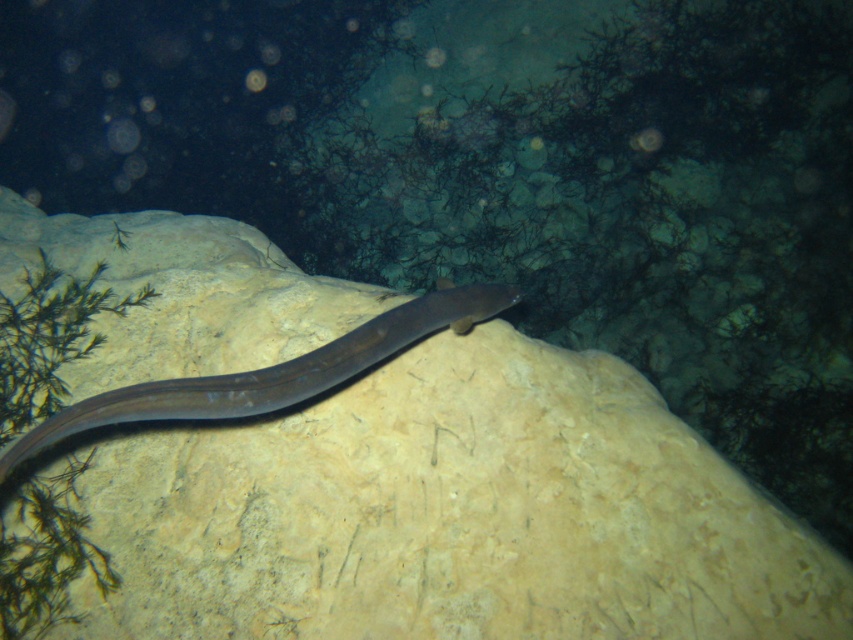
You are a marine biologist observing the underwater scene. You notice the smooth beige rock at center and the smooth gray snake at center. Which object is wider?

The smooth beige rock at center is wider than the smooth gray snake at center, as its width surpasses the snake.

You are a marine biologist studying underwater formations. You observe a point labeled at coordinates [450,513] in the image. Based on the scene described, what does this point most likely represent?

The point at coordinates [450,513] most likely represents the smooth beige rock at center as indicated by the description.

You are a diver exploring the underwater scene. You notice two points marked in the image. Which point is closer to you, point (308, 480) or point (437, 316)?

Point (308, 480) is in front of point (437, 316), so it is closer to you.